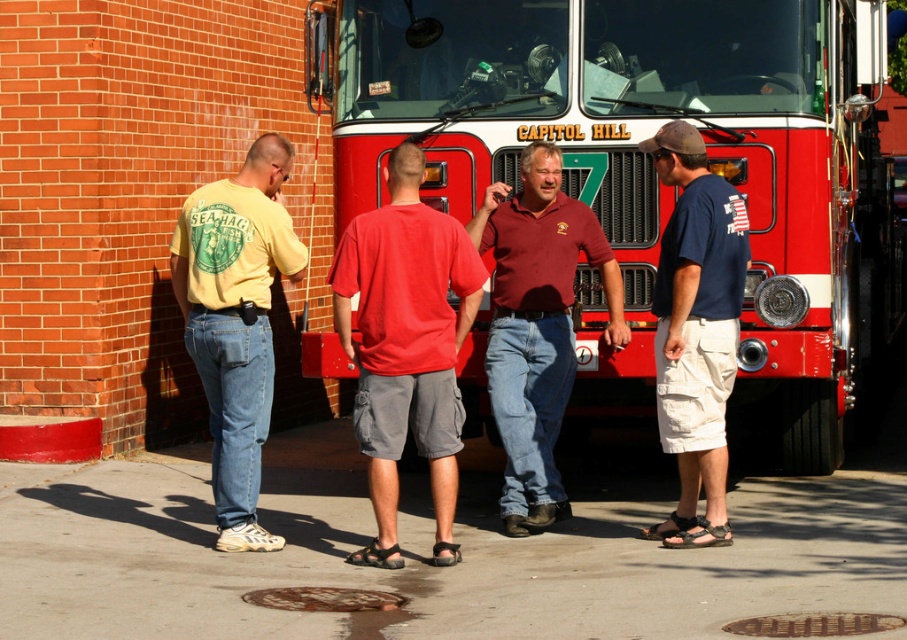
Question: Which of the following is the closest to the observer?

Choices:
 (A) red matte fire truck at center
 (B) maroon cotton shirt at center
 (C) matte yellow t-shirt at left
 (D) tan cargo shorts at right

Answer: (C)

Question: In this image, where is red cotton t-shirt at center located relative to maroon cotton shirt at center?

Choices:
 (A) above
 (B) below

Answer: (B)

Question: Can you confirm if maroon cotton shirt at center is positioned to the right of tan cargo shorts at right?

Choices:
 (A) no
 (B) yes

Answer: (A)

Question: Which point is farther to the camera?

Choices:
 (A) red matte fire truck at center
 (B) matte yellow t-shirt at left
 (C) tan cargo shorts at right

Answer: (A)

Question: Estimate the real-world distances between objects in this image. Which object is farther from the maroon cotton shirt at center?

Choices:
 (A) matte yellow t-shirt at left
 (B) red cotton t-shirt at center
 (C) red matte fire truck at center

Answer: (A)

Question: Does maroon cotton shirt at center appear under tan cargo shorts at right?

Choices:
 (A) no
 (B) yes

Answer: (B)